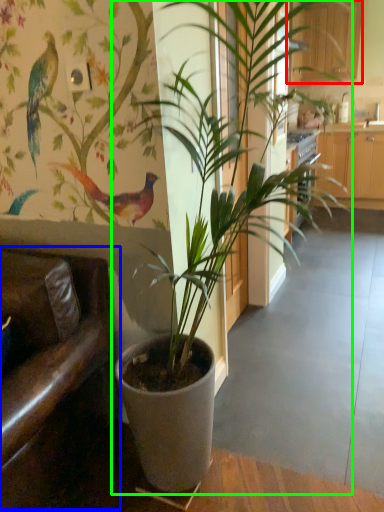
Question: Which object is positioned farthest from furniture (highlighted by a red box)? Select from armchair (highlighted by a blue box) and houseplant (highlighted by a green box).

Choices:
 (A) armchair
 (B) houseplant

Answer: (A)